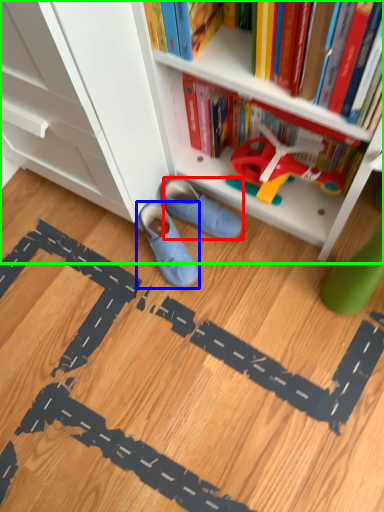
Question: Which object is positioned closest to footwear (highlighted by a red box)? Select from footwear (highlighted by a blue box) and bookcase (highlighted by a green box).

Choices:
 (A) footwear
 (B) bookcase

Answer: (A)